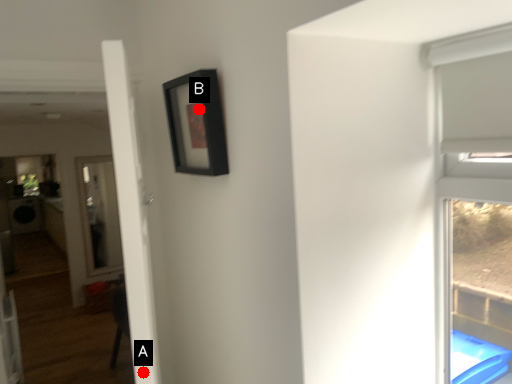
Question: Two points are circled on the image, labeled by A and B beside each circle. Which point appears farthest from the camera in this image?

Choices:
 (A) A is further
 (B) B is further

Answer: (B)